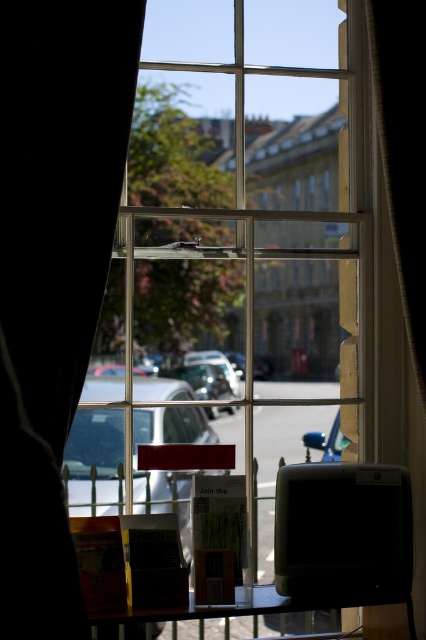
Is metallic silver car at center shorter than wooden table at lower center?

No.

Who is more forward, (81, 432) or (265, 588)?

Point (265, 588)

Identify the location of metallic silver car at center. (95, 454).

Does black matte curtain at left have a smaller size compared to shiny blue car at center?

Actually, black matte curtain at left might be larger than shiny blue car at center.

Is point (25, 577) in front of point (307, 436)?

Yes, point (25, 577) is in front of point (307, 436).

Find the location of `black matte curtain at left`. black matte curtain at left is located at coordinates (52, 273).

Does point (89, 154) come behind point (219, 614)?

No, it is in front of (219, 614).

Is point (2, 440) farther from camera compared to point (299, 628)?

No, it is in front of (299, 628).

Where is `black matte curtain at left`? The width and height of the screenshot is (426, 640). black matte curtain at left is located at coordinates (52, 273).